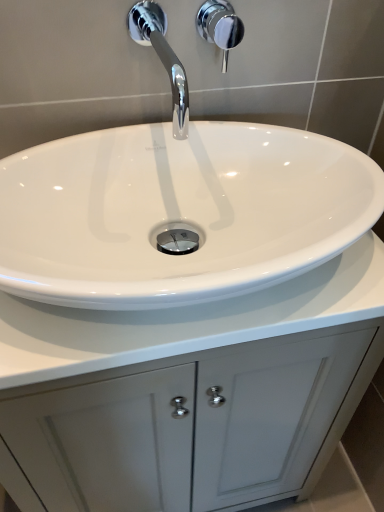
Question: From a real-world perspective, is white glossy cabinet at center located higher than chrome/metallic faucet at upper center?

Choices:
 (A) yes
 (B) no

Answer: (B)

Question: From the image's perspective, does white glossy cabinet at center appear lower than chrome/metallic faucet at upper center?

Choices:
 (A) yes
 (B) no

Answer: (A)

Question: Does white glossy cabinet at center have a larger size compared to chrome/metallic faucet at upper center?

Choices:
 (A) yes
 (B) no

Answer: (A)

Question: Can you confirm if white glossy cabinet at center is taller than chrome/metallic faucet at upper center?

Choices:
 (A) yes
 (B) no

Answer: (A)

Question: Is white glossy cabinet at center closer to the viewer compared to chrome/metallic faucet at upper center?

Choices:
 (A) no
 (B) yes

Answer: (A)

Question: From a real-world perspective, is white glossy sink at center physically located above or below white glossy cabinet at center?

Choices:
 (A) above
 (B) below

Answer: (A)

Question: Considering the relative positions of white glossy sink at center and white glossy cabinet at center in the image provided, is white glossy sink at center to the left or to the right of white glossy cabinet at center?

Choices:
 (A) right
 (B) left

Answer: (A)

Question: In terms of width, does white glossy sink at center look wider or thinner when compared to white glossy cabinet at center?

Choices:
 (A) wide
 (B) thin

Answer: (B)

Question: Does point (198, 117) appear closer or farther from the camera than point (309, 448)?

Choices:
 (A) closer
 (B) farther

Answer: (A)

Question: Relative to chrome/metallic faucet at upper center, is chrome metallic shower handle at upper center in front or behind?

Choices:
 (A) front
 (B) behind

Answer: (B)

Question: From a real-world perspective, relative to chrome/metallic faucet at upper center, is chrome metallic shower handle at upper center vertically above or below?

Choices:
 (A) below
 (B) above

Answer: (A)

Question: Is chrome metallic shower handle at upper center to the left or to the right of chrome/metallic faucet at upper center in the image?

Choices:
 (A) right
 (B) left

Answer: (A)

Question: Looking at the image, does chrome metallic shower handle at upper center seem bigger or smaller compared to chrome/metallic faucet at upper center?

Choices:
 (A) big
 (B) small

Answer: (B)

Question: Would you say white glossy cabinet at center is to the left or to the right of chrome metallic shower handle at upper center in the picture?

Choices:
 (A) right
 (B) left

Answer: (B)

Question: Considering their positions, is white glossy cabinet at center located in front of or behind chrome metallic shower handle at upper center?

Choices:
 (A) front
 (B) behind

Answer: (A)